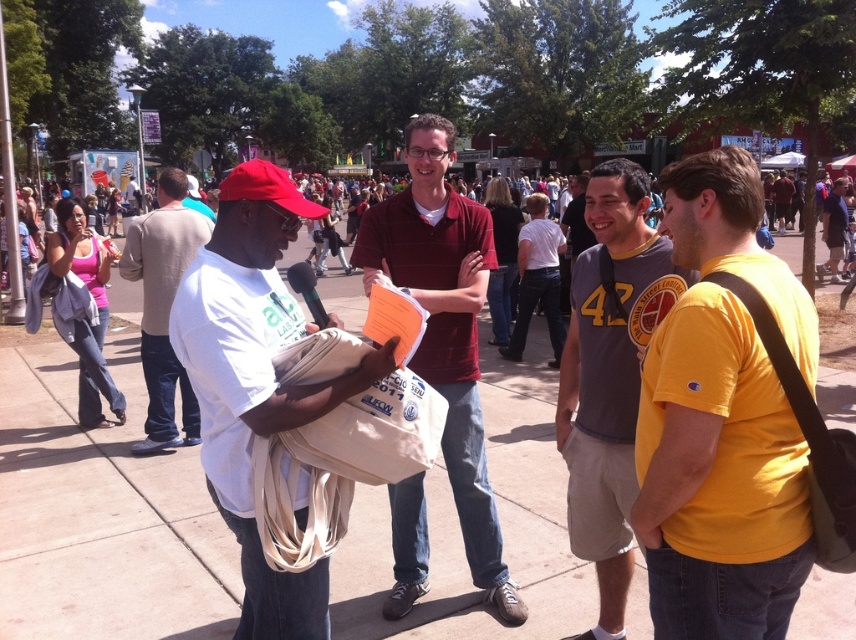
Question: Which of the following is the closest to the observer?

Choices:
 (A) (215, 460)
 (B) (474, 582)

Answer: (A)

Question: Considering the real-world distances, which object is closest to the white cotton shirt at center?

Choices:
 (A) maroon striped shirt at center
 (B) yellow jersey at center
 (C) white canvas bag at center

Answer: (B)

Question: Which object appears closest to the camera in this image?

Choices:
 (A) maroon striped shirt at center
 (B) yellow jersey at center
 (C) white canvas bag at center
 (D) white cotton shirt at center

Answer: (C)

Question: Can you confirm if yellow cotton t-shirt at center is positioned above maroon striped shirt at center?

Choices:
 (A) no
 (B) yes

Answer: (A)

Question: Does white canvas bag at center appear under white cotton shirt at center?

Choices:
 (A) no
 (B) yes

Answer: (B)

Question: Does maroon striped shirt at center have a larger size compared to white cotton shirt at center?

Choices:
 (A) no
 (B) yes

Answer: (A)